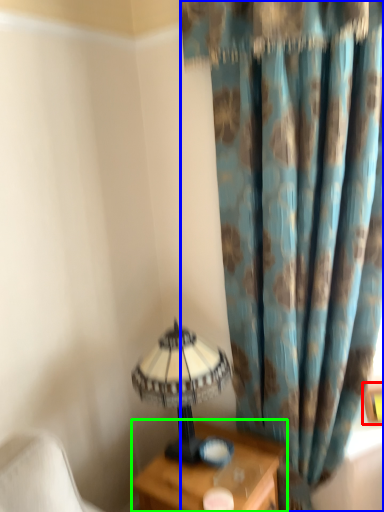
Question: Estimate the real-world distances between objects in this image. Which object is closer to picture frame (highlighted by a red box), curtain (highlighted by a blue box) or nightstand (highlighted by a green box)?

Choices:
 (A) curtain
 (B) nightstand

Answer: (B)